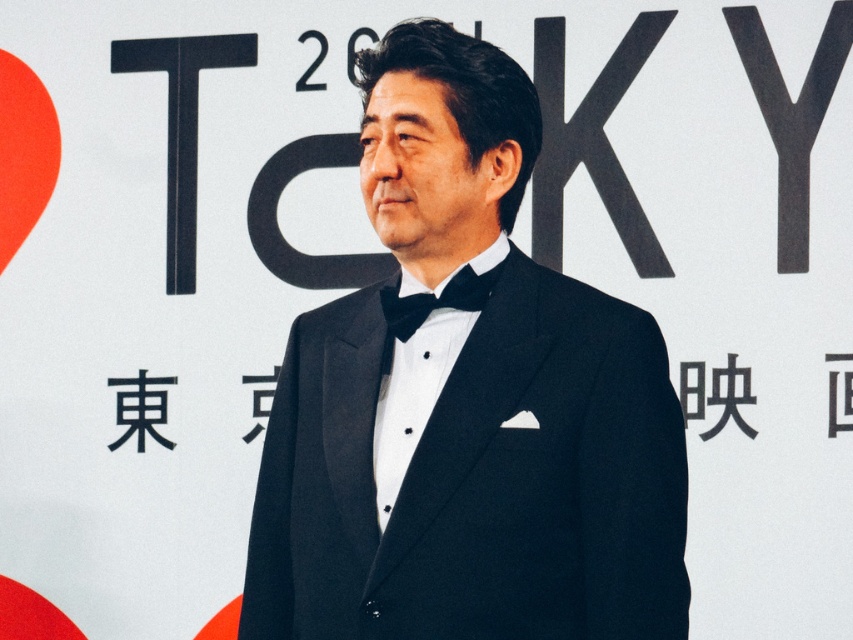
Can you confirm if black satin tuxedo at center is thinner than black satin bow tie at center?

No, black satin tuxedo at center is not thinner than black satin bow tie at center.

Is point (453, 593) positioned after point (405, 332)?

No, it is in front of (405, 332).

Between point (508, 627) and point (448, 282), which one is positioned behind?

The point (448, 282) is more distant.

The image size is (853, 640). Find the location of `black satin tuxedo at center`. black satin tuxedo at center is located at coordinates (466, 404).